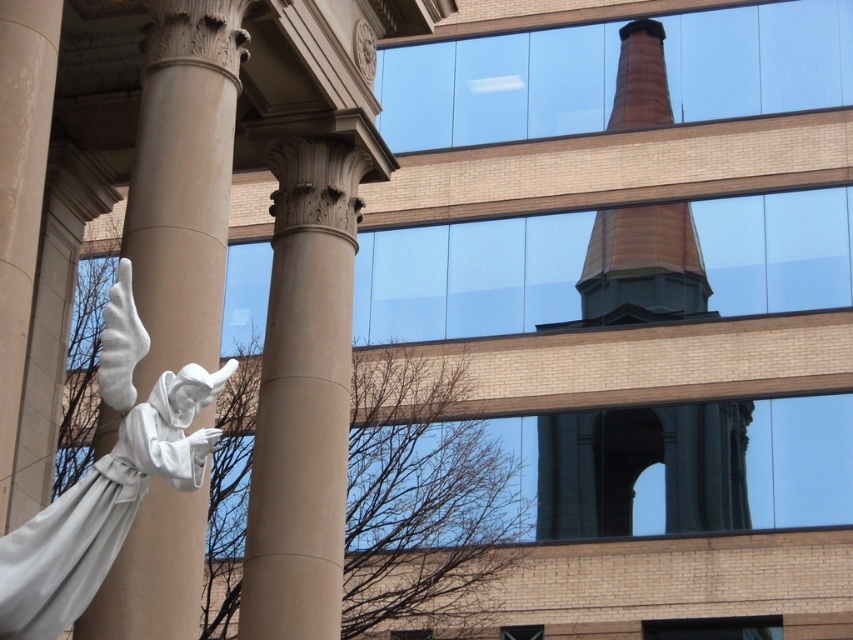
Question: Is white marble column at left further to the viewer compared to white marble statue at left?

Choices:
 (A) no
 (B) yes

Answer: (B)

Question: Which point is farther from the camera taking this photo?

Choices:
 (A) (177, 625)
 (B) (637, 454)
 (C) (347, 291)

Answer: (B)

Question: Which object is closer to the camera taking this photo?

Choices:
 (A) brown brick bell tower at upper center
 (B) white marble column at left
 (C) smooth beige column at center
 (D) white marble statue at left

Answer: (D)

Question: Which object appears farthest from the camera in this image?

Choices:
 (A) smooth beige column at center
 (B) brown brick bell tower at upper center
 (C) white marble column at left
 (D) white marble statue at left

Answer: (B)

Question: Is brown brick bell tower at upper center smaller than white marble statue at left?

Choices:
 (A) no
 (B) yes

Answer: (A)

Question: Can you confirm if brown brick bell tower at upper center is smaller than white marble statue at left?

Choices:
 (A) yes
 (B) no

Answer: (B)